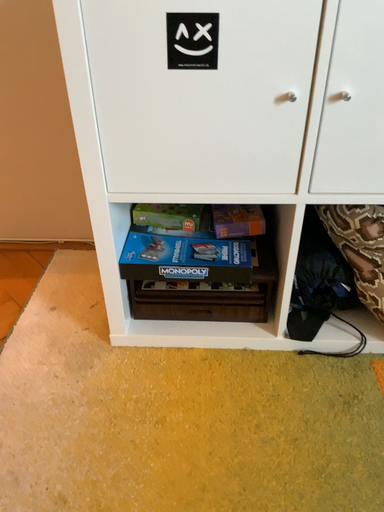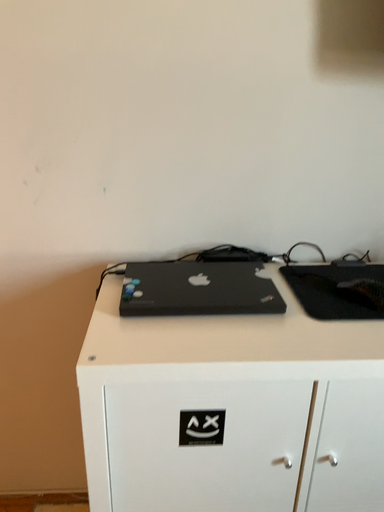
Question: Which way did the camera rotate in the video?

Choices:
 (A) rotated downward
 (B) rotated upward

Answer: (B)